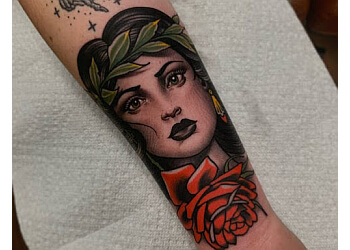
Where is `paper towel`? This screenshot has height=250, width=350. paper towel is located at coordinates (65, 204).